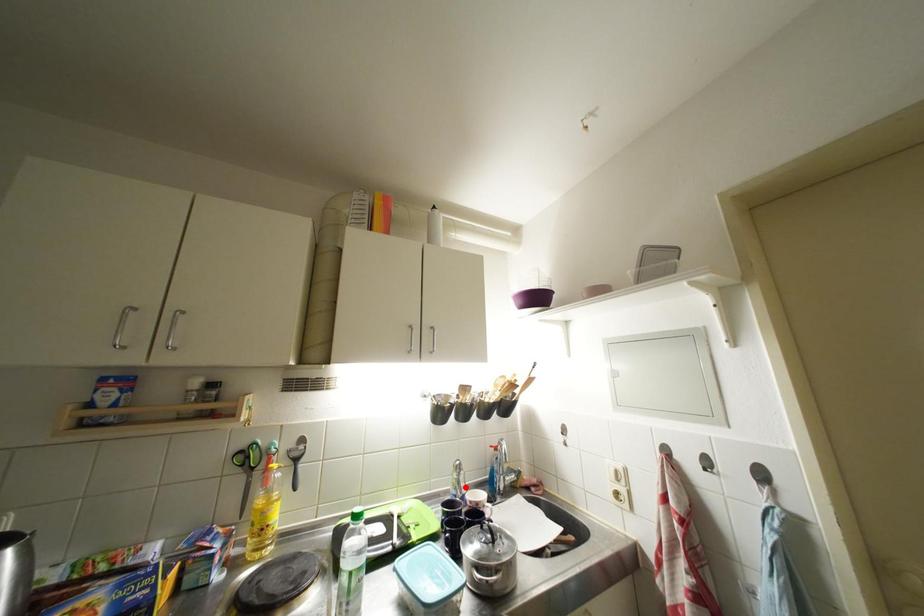
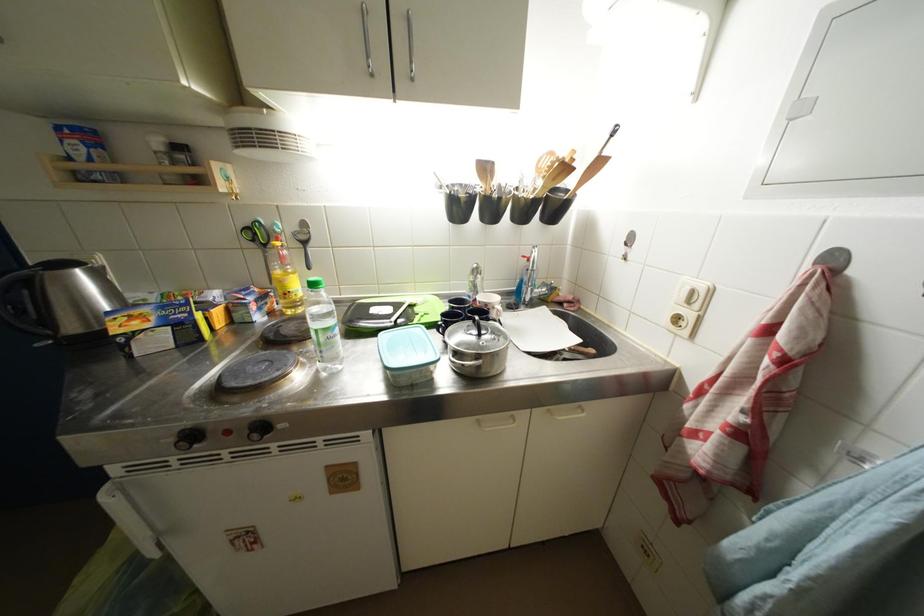
Question: I am providing you with two images of the same scene from different viewpoints. Given a red point in image1, look at the same physical point in image2. Is it:

Choices:
 (A) Closer to the viewpoint
 (B) Farther from the viewpoint

Answer: (A)